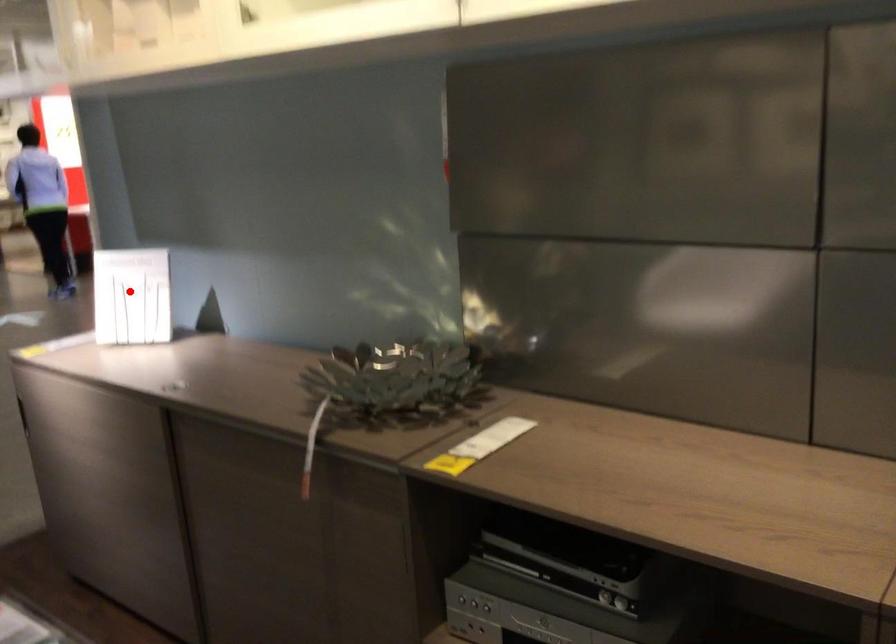
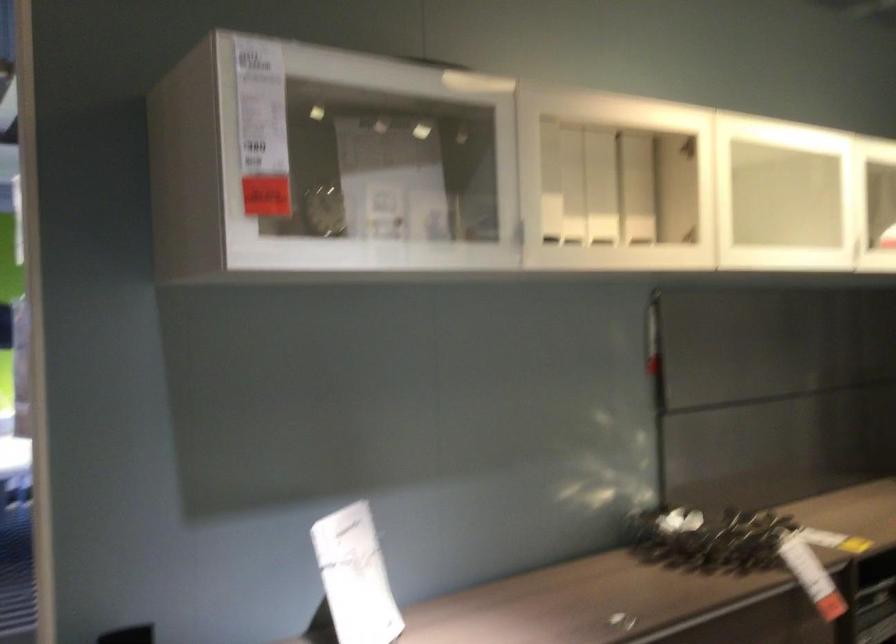
Question: I am providing you with two images of the same scene from different viewpoints. A red point is shown in image1. For the corresponding object point in image2, is it positioned nearer or farther from the camera?

Choices:
 (A) Nearer
 (B) Farther

Answer: (A)